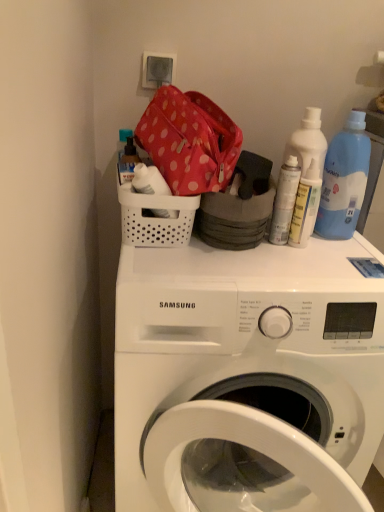
Find the location of a particular element. vacant space that is to the left of translucent plastic spray can at upper right, the 1th bottle positioned from the right is located at coordinates (213, 253).